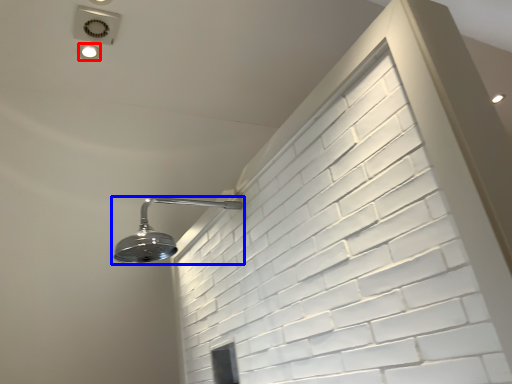
Question: Which point is further to the camera, droplight (highlighted by a red box) or shower (highlighted by a blue box)?

Choices:
 (A) droplight
 (B) shower

Answer: (A)